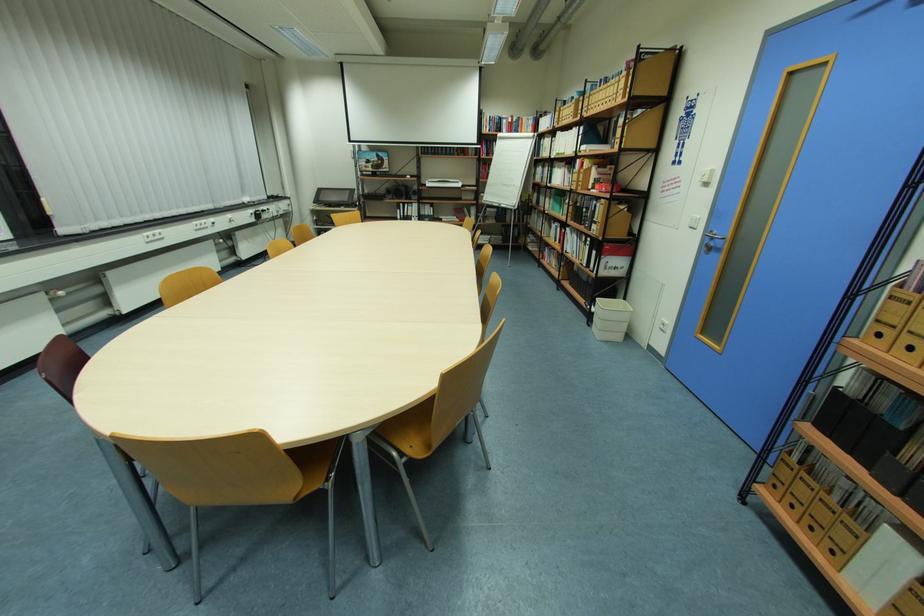
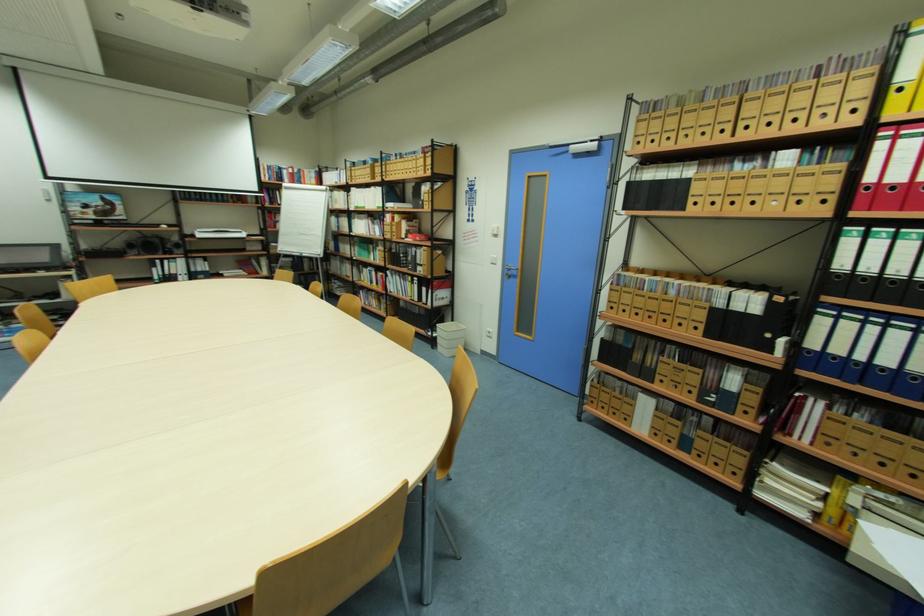
Question: How did the camera likely rotate?

Choices:
 (A) Left
 (B) Right
 (C) Up
 (D) Down

Answer: (B)